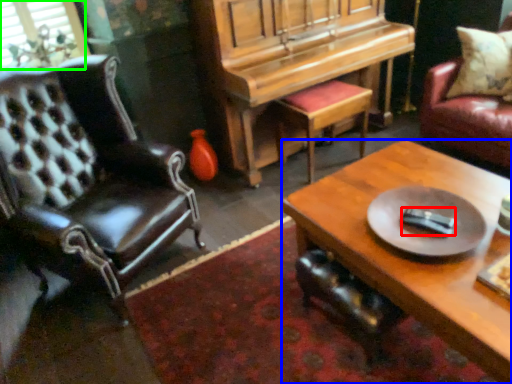
Question: Which object is positioned farthest from remote control (highlighted by a red box)? Select from coffee table (highlighted by a blue box) and window screen (highlighted by a green box).

Choices:
 (A) coffee table
 (B) window screen

Answer: (B)